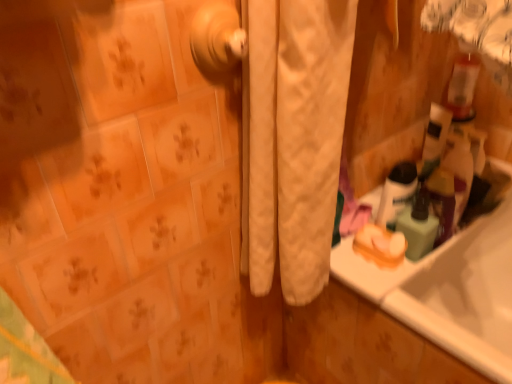
Question: Does polished brass door handle at center have a greater height compared to white quilted curtain at center?

Choices:
 (A) no
 (B) yes

Answer: (A)

Question: From the image's perspective, is polished brass door handle at center on white quilted curtain at center?

Choices:
 (A) no
 (B) yes

Answer: (B)

Question: Considering the relative positions of polished brass door handle at center and white quilted curtain at center in the image provided, is polished brass door handle at center in front of white quilted curtain at center?

Choices:
 (A) yes
 (B) no

Answer: (B)

Question: From the image's perspective, would you say polished brass door handle at center is shown under white quilted curtain at center?

Choices:
 (A) no
 (B) yes

Answer: (A)

Question: Considering the relative sizes of polished brass door handle at center and white quilted curtain at center in the image provided, is polished brass door handle at center smaller than white quilted curtain at center?

Choices:
 (A) yes
 (B) no

Answer: (A)

Question: From a real-world perspective, is polished brass door handle at center on white quilted curtain at center?

Choices:
 (A) yes
 (B) no

Answer: (A)

Question: Does white glossy mouthwash at upper right have a larger size compared to translucent plastic soap dispenser at right?

Choices:
 (A) yes
 (B) no

Answer: (A)

Question: From the image's perspective, is white glossy mouthwash at upper right beneath translucent plastic soap dispenser at right?

Choices:
 (A) yes
 (B) no

Answer: (B)

Question: Is white glossy mouthwash at upper right in contact with translucent plastic soap dispenser at right?

Choices:
 (A) yes
 (B) no

Answer: (A)

Question: Is white glossy mouthwash at upper right positioned with its back to translucent plastic soap dispenser at right?

Choices:
 (A) yes
 (B) no

Answer: (A)

Question: Does white glossy mouthwash at upper right lie in front of translucent plastic soap dispenser at right?

Choices:
 (A) yes
 (B) no

Answer: (B)

Question: Does white glossy mouthwash at upper right appear on the left side of translucent plastic soap dispenser at right?

Choices:
 (A) no
 (B) yes

Answer: (B)

Question: Does white glossy mouthwash at upper right have a greater width compared to white quilted curtain at center?

Choices:
 (A) no
 (B) yes

Answer: (A)